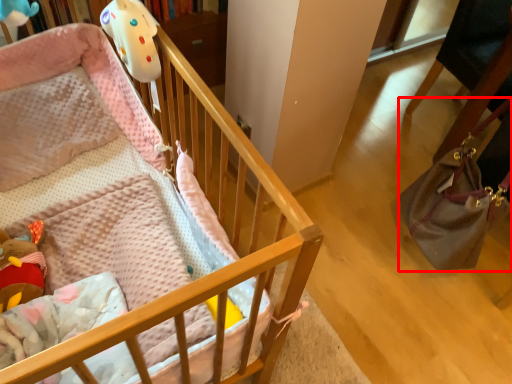
Question: From the image's perspective, what is the correct spatial positioning of handbag (annotated by the red box) in reference to infant bed?

Choices:
 (A) below
 (B) above

Answer: (B)